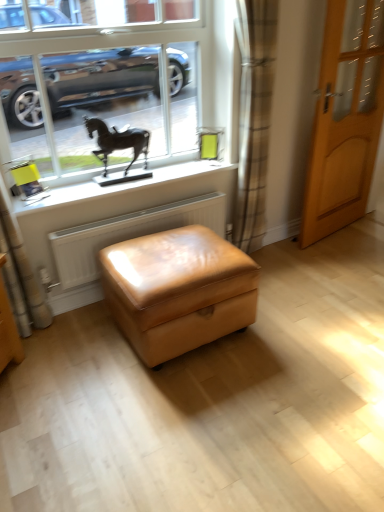
Identify the location of vacant space in front of light brown wooden door at right. (345, 262).